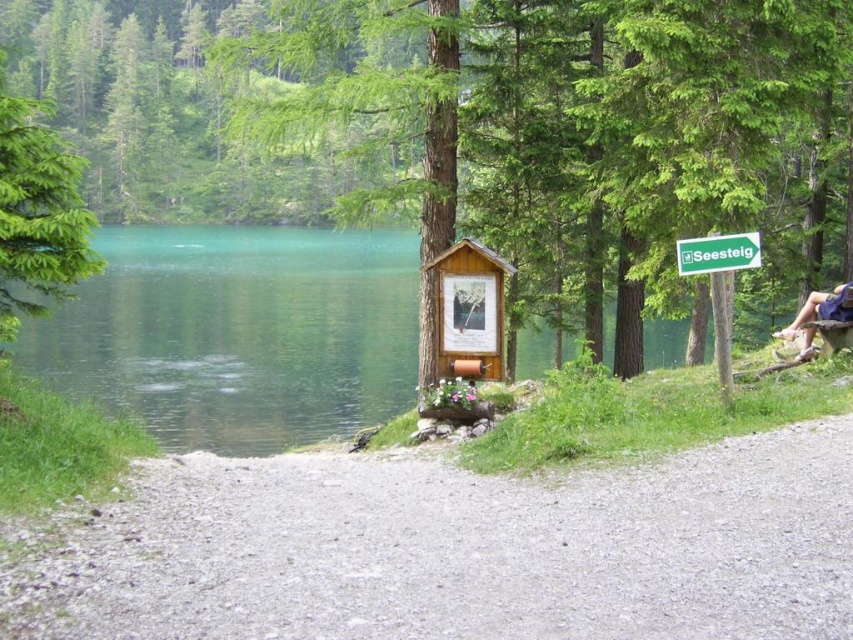
Question: Which point appears closest to the camera in this image?

Choices:
 (A) (838, 328)
 (B) (488, 308)
 (C) (3, 140)

Answer: (C)

Question: Is gray gravel path at center further to camera compared to green plastic sign at upper right?

Choices:
 (A) no
 (B) yes

Answer: (A)

Question: Among these points, which one is farthest from the camera?

Choices:
 (A) (746, 250)
 (B) (144, 490)
 (C) (0, 116)

Answer: (A)

Question: Does green glossy water at left have a greater width compared to brown wooden bench at right?

Choices:
 (A) yes
 (B) no

Answer: (A)

Question: Does green matte tree at upper left have a greater width compared to green plastic sign at upper right?

Choices:
 (A) no
 (B) yes

Answer: (B)

Question: Which object is farther from the camera taking this photo?

Choices:
 (A) brown wooden bench at right
 (B) green glossy water at left

Answer: (A)